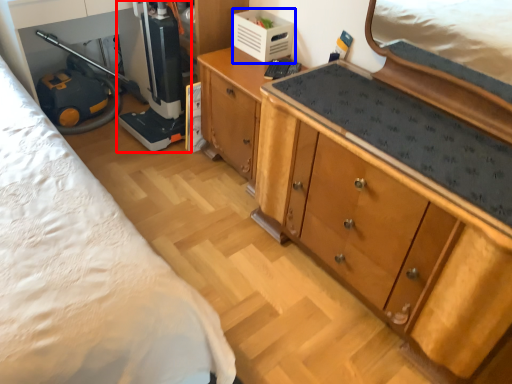
Question: Among these objects, which one is farthest to the camera, appliance (highlighted by a red box) or appliance (highlighted by a blue box)?

Choices:
 (A) appliance
 (B) appliance

Answer: (B)